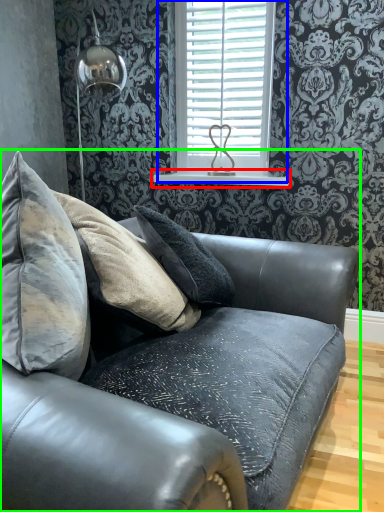
Question: Which object is the closest to the window sill (highlighted by a red box)? Choose among these: window (highlighted by a blue box) or studio couch (highlighted by a green box).

Choices:
 (A) window
 (B) studio couch

Answer: (A)